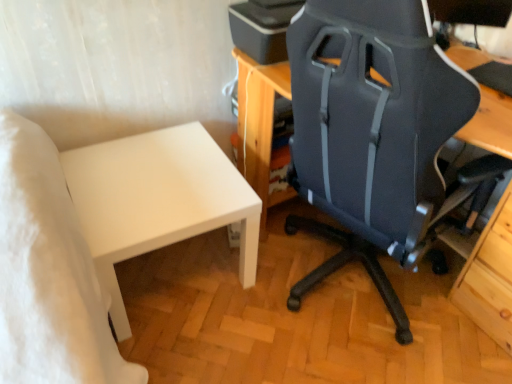
Image resolution: width=512 pixels, height=384 pixels. Describe the element at coordinates (262, 28) in the screenshot. I see `matte black printer at upper center` at that location.

The image size is (512, 384). In order to click on matte black chair at center in this screenshot , I will do pos(371,132).

How far apart are matte black printer at upper center and matte black chair at center?

matte black printer at upper center is 17.38 inches from matte black chair at center.

From a real-world perspective, is matte black printer at upper center physically located above or below matte black chair at center?

From a real-world perspective, matte black printer at upper center is physically above matte black chair at center.

From the image's perspective, between matte black printer at upper center and matte black chair at center, who is located below?

From the image's view, matte black chair at center is below.

Which of these two, matte black printer at upper center or matte black chair at center, is smaller?

matte black printer at upper center.

Is matte black printer at upper center turned away from white matte table at lower left?

No, matte black printer at upper center's orientation is not away from white matte table at lower left.

From the image's perspective, who appears lower, matte black printer at upper center or white matte table at lower left?

From the image's view, white matte table at lower left is below.

Considering the sizes of matte black printer at upper center and white matte table at lower left in the image, is matte black printer at upper center bigger or smaller than white matte table at lower left?

Considering their sizes, matte black printer at upper center takes up less space than white matte table at lower left.

From the image's perspective, relative to matte black printer at upper center, is white matte table at lower left above or below?

Based on their image positions, white matte table at lower left is located beneath matte black printer at upper center.

Considering the sizes of objects white matte table at lower left and matte black printer at upper center in the image provided, who is taller, white matte table at lower left or matte black printer at upper center?

With more height is white matte table at lower left.

Is white matte table at lower left spatially inside matte black printer at upper center, or outside of it?

white matte table at lower left is outside matte black printer at upper center.

Which is more to the right, white matte table at lower left or matte black printer at upper center?

matte black printer at upper center.

Is white matte table at lower left inside or outside of matte black chair at center?

The correct answer is: outside.

Between white matte table at lower left and matte black chair at center, which one has smaller size?

white matte table at lower left.

Is point (216, 202) farther from camera compared to point (293, 135)?

No, it is in front of (293, 135).

Is matte black chair at center in front of matte black printer at upper center?

Yes, it is.

From the image's perspective, is matte black chair at center located beneath matte black printer at upper center?

Yes, from the image's perspective, matte black chair at center is below matte black printer at upper center.

Considering the relative sizes of matte black chair at center and matte black printer at upper center in the image provided, is matte black chair at center thinner than matte black printer at upper center?

No, matte black chair at center is not thinner than matte black printer at upper center.

In the image, there is a matte black chair at center. Where is `table below it (from the image's perspective)`? The image size is (512, 384). table below it (from the image's perspective) is located at coordinates (157, 201).

Is matte black chair at center positioned before white matte table at lower left?

Yes, the depth of matte black chair at center is less than that of white matte table at lower left.

How many degrees apart are the facing directions of matte black chair at center and white matte table at lower left?

The angular difference between matte black chair at center and white matte table at lower left is 107 degrees.

Identify the location of chair that is below the matte black printer at upper center (from the image's perspective). The image size is (512, 384). (371, 132).

The image size is (512, 384). I want to click on table that appears below the matte black printer at upper center (from a real-world perspective), so click(157, 201).

From the image, which object appears to be nearer to matte black chair at center, white matte table at lower left or matte black printer at upper center?

Among the two, matte black printer at upper center is located nearer to matte black chair at center.

Estimate the real-world distances between objects in this image. Which object is further from white matte table at lower left, matte black chair at center or matte black printer at upper center?

The object further to white matte table at lower left is matte black printer at upper center.

Which object lies nearer to the anchor point matte black chair at center, matte black printer at upper center or white matte table at lower left?

The object closer to matte black chair at center is matte black printer at upper center.

Based on their spatial positions, is matte black printer at upper center or matte black chair at center closer to white matte table at lower left?

matte black chair at center is closer to white matte table at lower left.

Looking at the image, which one is located further to matte black printer at upper center, matte black chair at center or white matte table at lower left?

white matte table at lower left lies further to matte black printer at upper center than the other object.

In the scene shown: Which object lies further to the anchor point matte black printer at upper center, white matte table at lower left or matte black chair at center?

The object further to matte black printer at upper center is white matte table at lower left.

Image resolution: width=512 pixels, height=384 pixels. I want to click on table between matte black chair at center and matte black printer at upper center from front to back, so click(x=157, y=201).